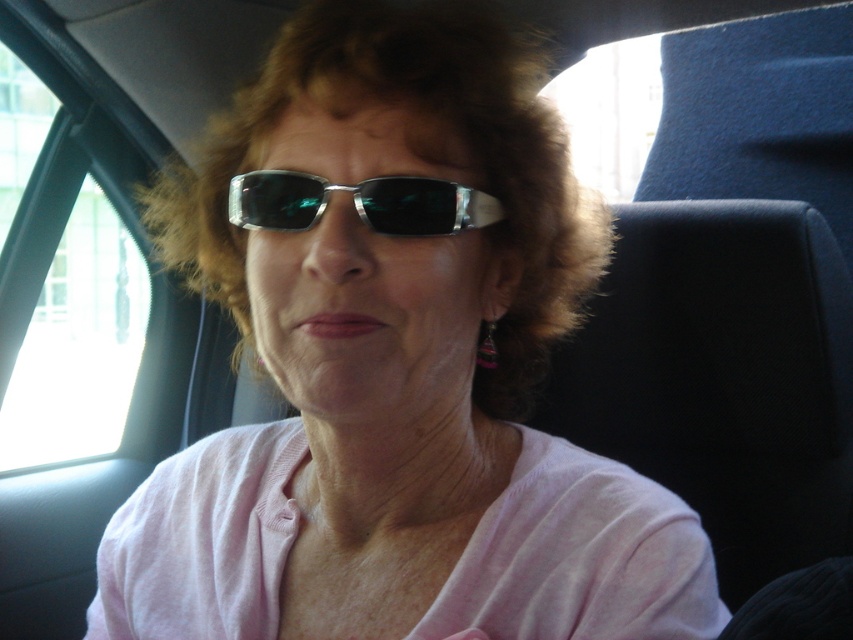
You are a photographer trying to capture the best shot of the person in the car. The transparent glass window at upper left is located at coordinates 0.536, 0.093. If you want to avoid the window from being in the frame, should you adjust your camera to the left or right?

The transparent glass window at upper left is located at coordinates (78, 342). To avoid including it in the frame, adjust the camera to the right since the window is positioned on the left side of the image.

You are a photographer trying to capture a clear photo of the metallic reflective sunglasses at center through the transparent glass window at upper left. Will the sunglasses be visible in the photo?

The metallic reflective sunglasses at center is behind the transparent glass window at upper left, so the sunglasses will be visible in the photo as the window allows light to pass through.

You are standing at point (x=3, y=45) and want to take a photo of the person in the car. The camera you have can only focus on objects within 2 meters. Will the camera be able to focus on the person?

The distance between point (x=3, y=45) and the camera is 1.93 meters, which is within the 2 meter range. Therefore, the camera will be able to focus on the person.